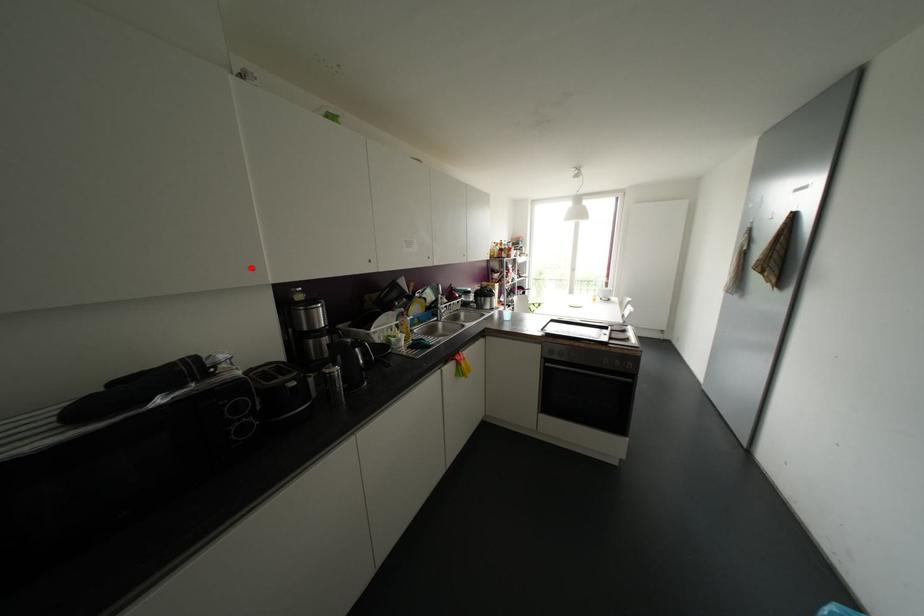
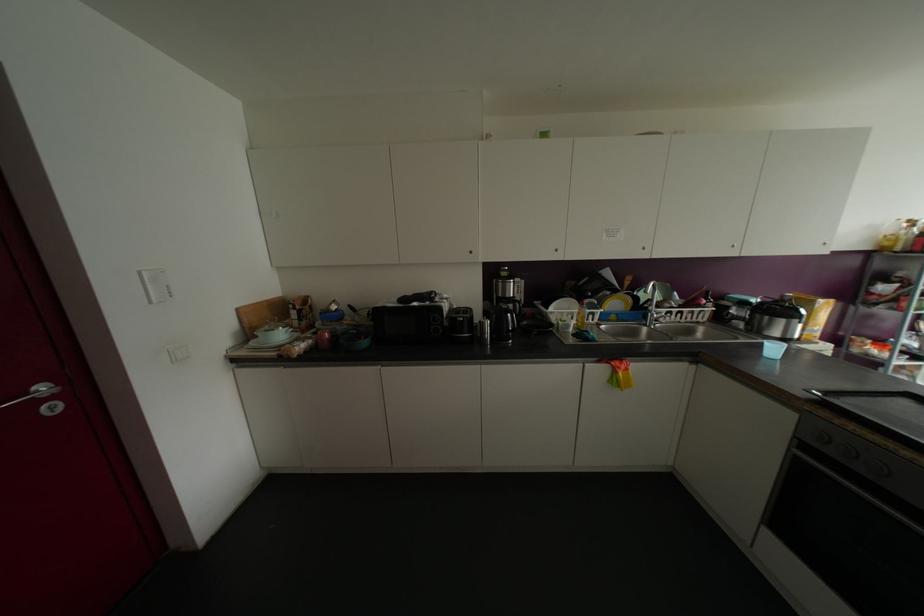
Where in the second image is the point corresponding to the highlighted location from the first image?

(469, 252)